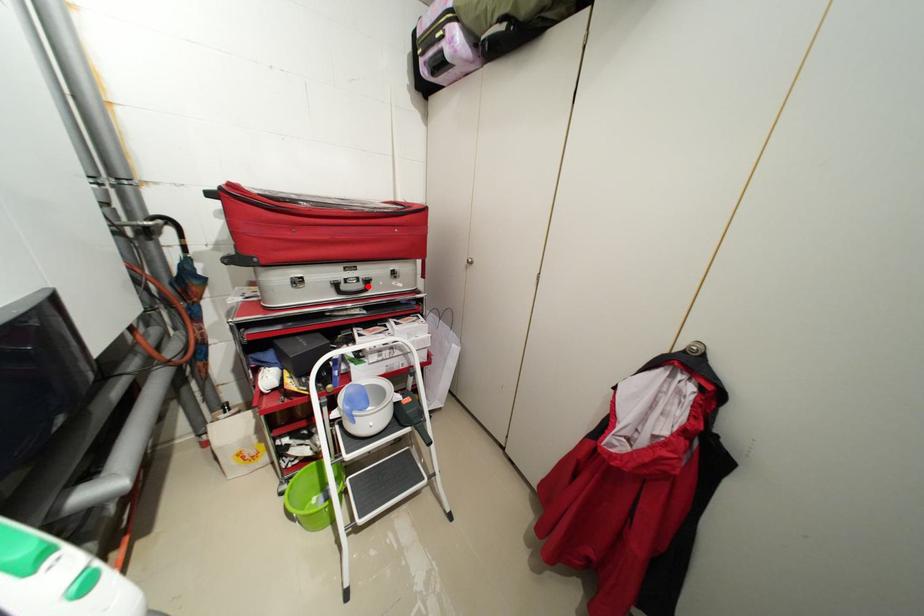
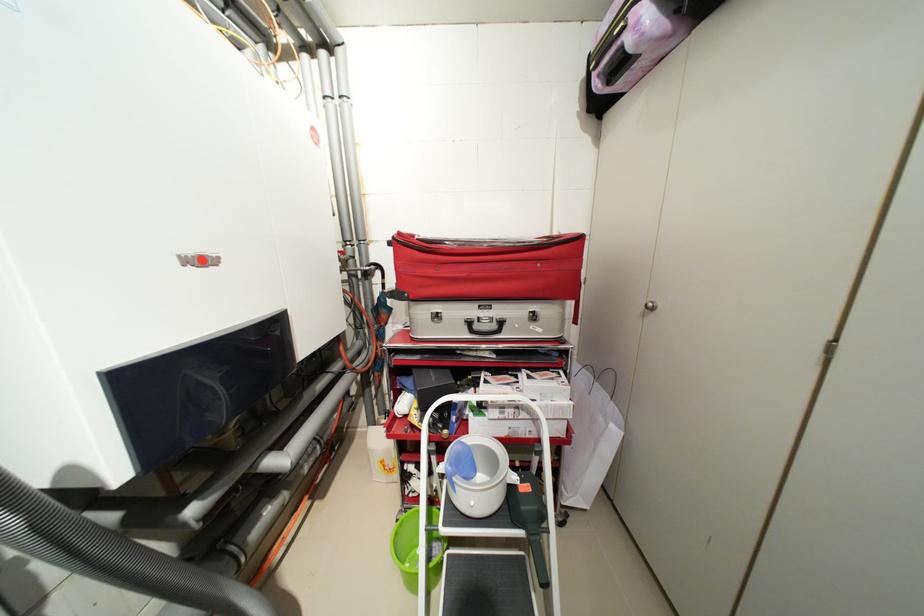
Locate, in the second image, the point that corresponds to the highlighted location in the first image.

(502, 326)